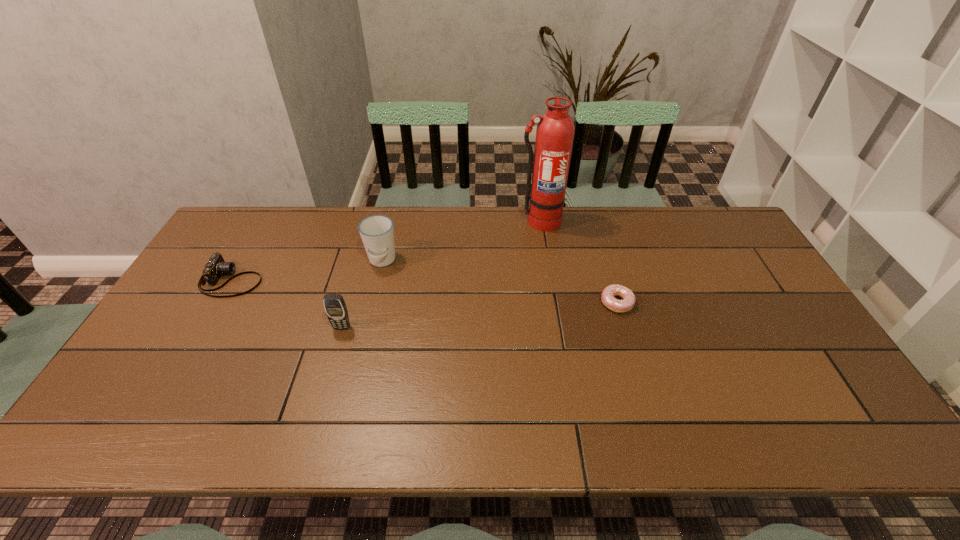
This screenshot has height=540, width=960. I want to click on fire extinguisher, so click(555, 131).

Where is `the farthest object`? The width and height of the screenshot is (960, 540). the farthest object is located at coordinates (555, 131).

Identify the location of cup. (377, 232).

Locate an element on the screen. The height and width of the screenshot is (540, 960). the nearest object is located at coordinates (334, 304).

At what (x,y) coordinates should I click in order to perform the action: click on the second shortest object. Please return your answer as a coordinate pair (x, y). Looking at the image, I should click on (216, 267).

At what (x,y) coordinates should I click in order to perform the action: click on the leftmost object. Please return your answer as a coordinate pair (x, y). The image size is (960, 540). Looking at the image, I should click on (216, 267).

Where is `the rightmost object`? the rightmost object is located at coordinates (620, 306).

Locate an element on the screen. The width and height of the screenshot is (960, 540). the shortest object is located at coordinates (620, 306).

This screenshot has height=540, width=960. Identify the location of vacant region located on the label side of the fire extinguisher. (547, 268).

Where is `free space located with a handle on the side of the cup`? The image size is (960, 540). free space located with a handle on the side of the cup is located at coordinates (372, 303).